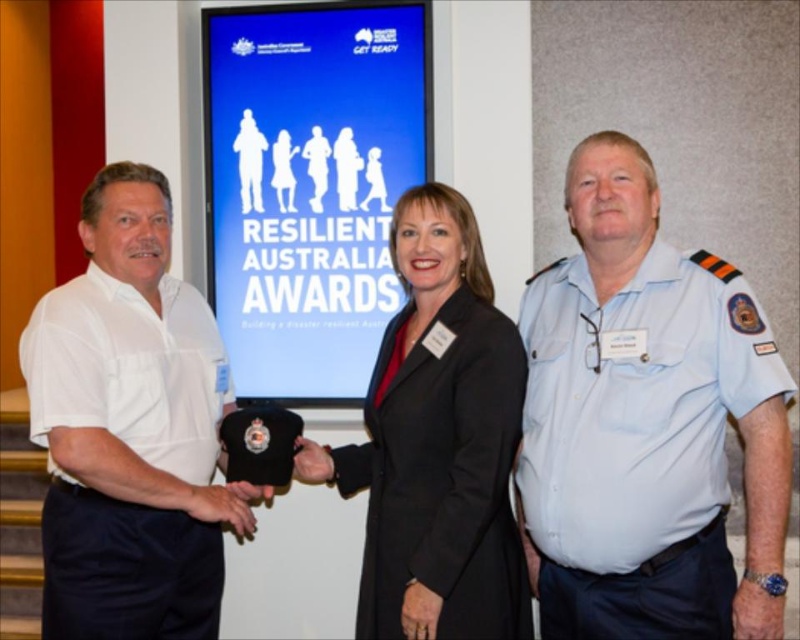
Question: Can you confirm if blue paper at center is bigger than white cotton shirt at left?

Choices:
 (A) yes
 (B) no

Answer: (B)

Question: Based on their relative distances, which object is farther from the blue paper at center?

Choices:
 (A) black fabric coat at center
 (B) light blue uniform at center
 (C) white cotton shirt at left

Answer: (B)

Question: Which point appears closest to the camera in this image?

Choices:
 (A) (246, 216)
 (B) (438, 465)

Answer: (B)

Question: Which of these objects is positioned closest to the light blue uniform at center?

Choices:
 (A) white cotton shirt at left
 (B) blue paper at center
 (C) black fabric coat at center

Answer: (C)

Question: Is light blue uniform at center bigger than blue paper at center?

Choices:
 (A) yes
 (B) no

Answer: (A)

Question: Is light blue uniform at center above white cotton shirt at left?

Choices:
 (A) no
 (B) yes

Answer: (B)